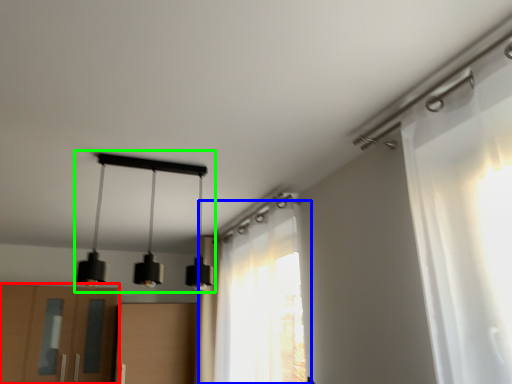
Question: Considering the real-world distances, which object is farthest from cabinetry (highlighted by a red box)? curtain (highlighted by a blue box) or lamp (highlighted by a green box)?

Choices:
 (A) curtain
 (B) lamp

Answer: (A)